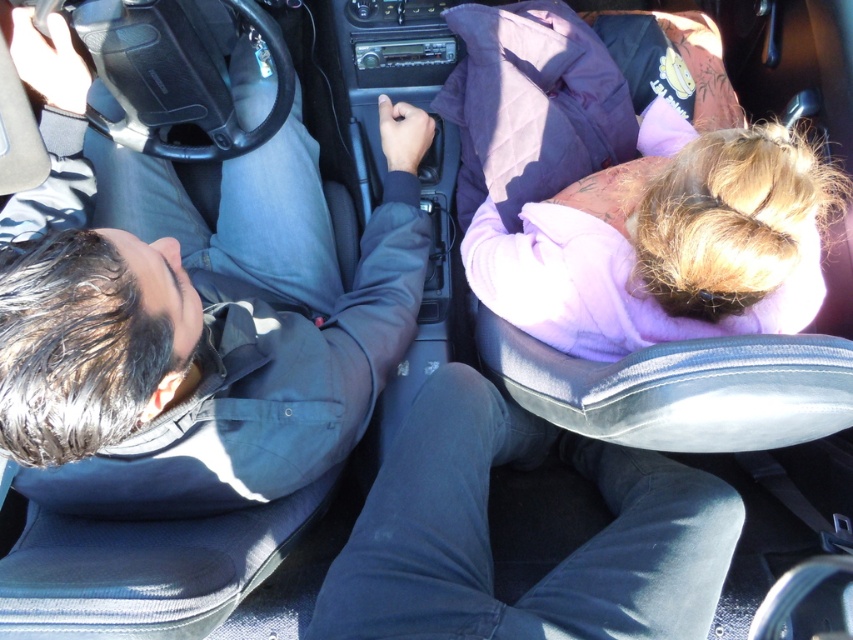
Does dark blue shirt at center appear over purple fleece jacket at upper right?

No.

Does dark blue shirt at center appear on the right side of purple fleece jacket at upper right?

Incorrect, dark blue shirt at center is not on the right side of purple fleece jacket at upper right.

Find the location of a particular element. This screenshot has width=853, height=640. dark blue shirt at center is located at coordinates (213, 326).